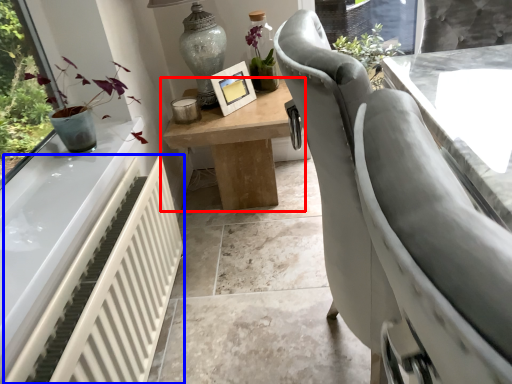
Question: Which object appears farthest to the camera in this image, table (highlighted by a red box) or radiator (highlighted by a blue box)?

Choices:
 (A) table
 (B) radiator

Answer: (A)